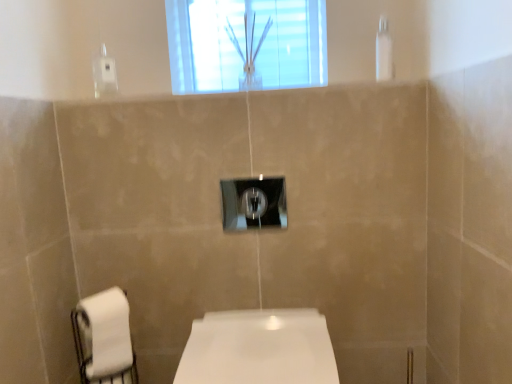
Question: From the image's perspective, would you say white matte toilet paper at lower left is positioned over clear glass vase at upper center?

Choices:
 (A) yes
 (B) no

Answer: (B)

Question: Is white matte toilet paper at lower left facing away from clear glass vase at upper center?

Choices:
 (A) yes
 (B) no

Answer: (B)

Question: Considering the relative sizes of white matte toilet paper at lower left and clear glass vase at upper center in the image provided, is white matte toilet paper at lower left smaller than clear glass vase at upper center?

Choices:
 (A) yes
 (B) no

Answer: (A)

Question: From a real-world perspective, is white matte toilet paper at lower left below clear glass vase at upper center?

Choices:
 (A) no
 (B) yes

Answer: (B)

Question: Does white matte toilet paper at lower left come in front of clear glass vase at upper center?

Choices:
 (A) yes
 (B) no

Answer: (A)

Question: Is the depth of white matte toilet paper at lower left greater than that of clear glass vase at upper center?

Choices:
 (A) no
 (B) yes

Answer: (A)

Question: From a real-world perspective, is satin nickel light switch at center located higher than clear plastic shower at upper right?

Choices:
 (A) no
 (B) yes

Answer: (A)

Question: Considering the relative sizes of satin nickel light switch at center and clear plastic shower at upper right in the image provided, is satin nickel light switch at center taller than clear plastic shower at upper right?

Choices:
 (A) no
 (B) yes

Answer: (A)

Question: Is satin nickel light switch at center positioned beyond the bounds of clear plastic shower at upper right?

Choices:
 (A) yes
 (B) no

Answer: (A)

Question: Is satin nickel light switch at center bigger than clear plastic shower at upper right?

Choices:
 (A) yes
 (B) no

Answer: (A)

Question: From the image's perspective, would you say satin nickel light switch at center is positioned over clear plastic shower at upper right?

Choices:
 (A) yes
 (B) no

Answer: (B)

Question: Does satin nickel light switch at center turn towards clear plastic shower at upper right?

Choices:
 (A) yes
 (B) no

Answer: (B)

Question: Does white glossy toilet at center have a smaller size compared to white matte toilet paper at lower left?

Choices:
 (A) no
 (B) yes

Answer: (A)